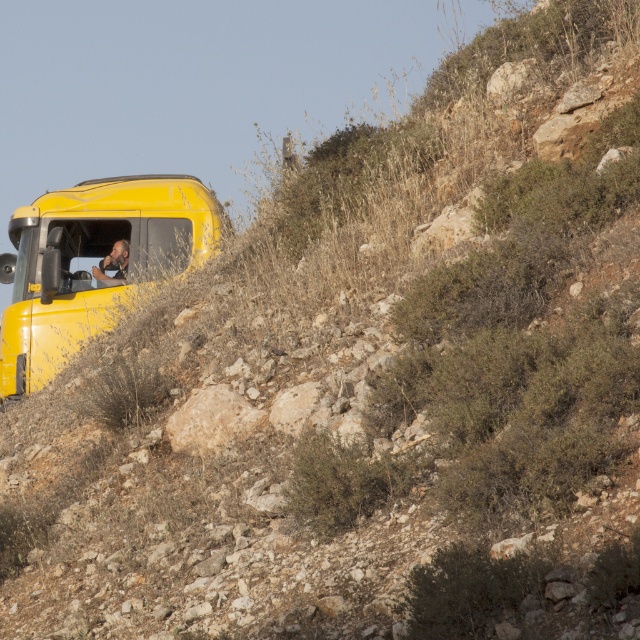
Question: Which point is farther from the camera taking this photo?

Choices:
 (A) (109, 227)
 (B) (102, 269)

Answer: (A)

Question: Can you confirm if shiny yellow truck at upper left is positioned above camouflage uniform at left?

Choices:
 (A) no
 (B) yes

Answer: (B)

Question: Which of the following is the farthest from the observer?

Choices:
 (A) (134, 211)
 (B) (115, 266)

Answer: (B)

Question: Does shiny yellow truck at upper left appear under camouflage uniform at left?

Choices:
 (A) no
 (B) yes

Answer: (A)

Question: Among these objects, which one is nearest to the camera?

Choices:
 (A) shiny yellow truck at upper left
 (B) camouflage uniform at left

Answer: (A)

Question: Can you confirm if shiny yellow truck at upper left is positioned to the left of camouflage uniform at left?

Choices:
 (A) yes
 (B) no

Answer: (A)